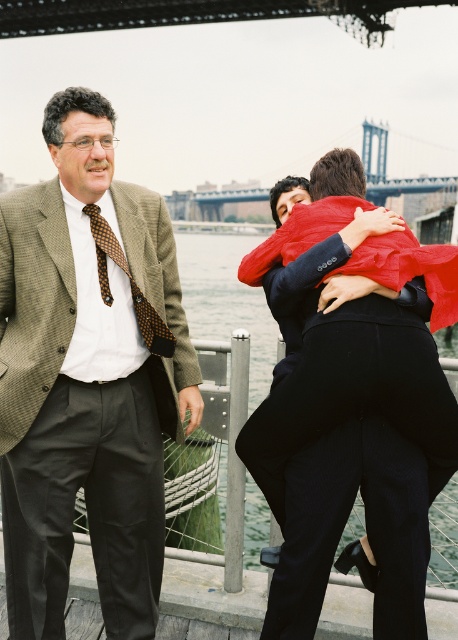
Between point (292, 369) and point (164, 333), which one is positioned behind?

Positioned behind is point (164, 333).

Is point (370, 355) positioned before point (99, 234)?

Yes, it is in front of point (99, 234).

The width and height of the screenshot is (458, 640). I want to click on velvet red coat at center, so click(x=349, y=442).

Does velvet red coat at center have a greater height compared to metallic gray bridge at upper center?

No, velvet red coat at center is not taller than metallic gray bridge at upper center.

Is velvet red coat at center thinner than metallic gray bridge at upper center?

Correct, velvet red coat at center's width is less than metallic gray bridge at upper center's.

Between point (310, 273) and point (366, 13), which one is positioned in front?

Point (310, 273) is in front.

Where is `velvet red coat at center`? velvet red coat at center is located at coordinates (349, 442).

Is matte brown suit at left positioned behind velvet red coat at center?

Yes.

Between matte brown suit at left and velvet red coat at center, which one has less height?

matte brown suit at left

Does point (114, 625) come farther from viewer compared to point (296, 300)?

Yes.

What are the coordinates of `matte brown suit at left` in the screenshot? It's located at (87, 378).